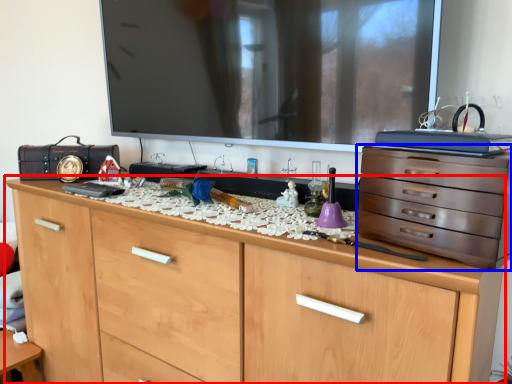
Question: Which of the following is the closest to the observer, chest of drawers (highlighted by a red box) or chest of drawers (highlighted by a blue box)?

Choices:
 (A) chest of drawers
 (B) chest of drawers

Answer: (A)